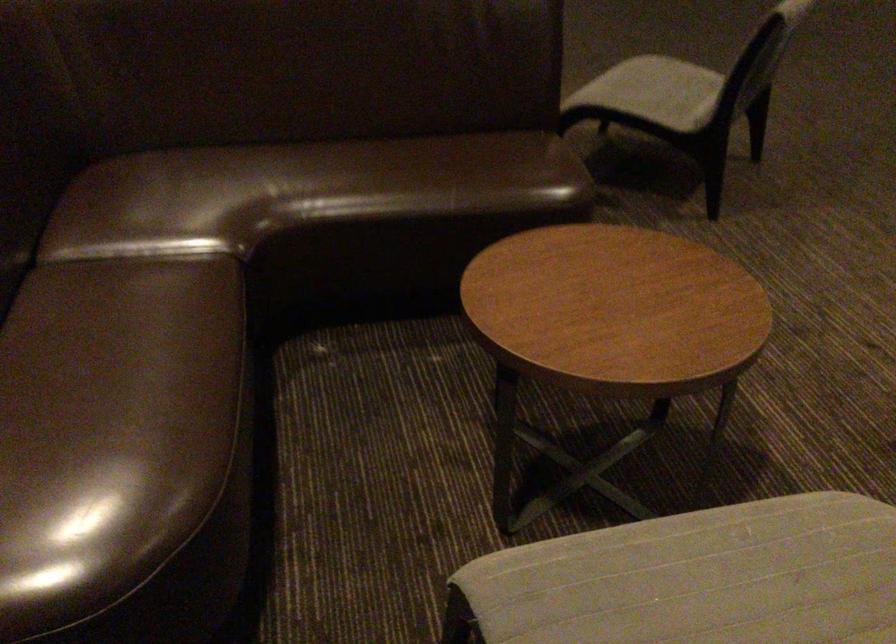
Describe the element at coordinates (655, 91) in the screenshot. I see `the chair sitting surface` at that location.